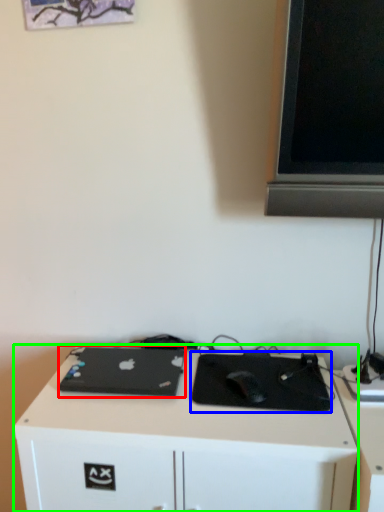
Question: Estimate the real-world distances between objects in this image. Which object is closer to laptop (highlighted by a red box), mousepad (highlighted by a blue box) or desk (highlighted by a green box)?

Choices:
 (A) mousepad
 (B) desk

Answer: (B)